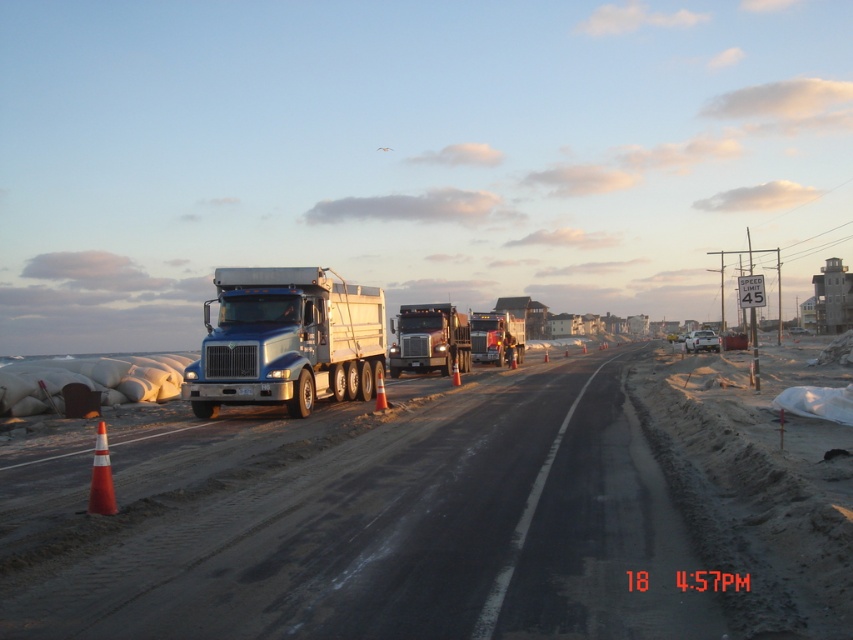
Question: Which of the following is the closest to the observer?

Choices:
 (A) blue metallic trailer truck at center
 (B) metallic silver truck at center

Answer: (A)

Question: In this image, where is blue metallic trailer truck at center located relative to metallic silver trailer truck at center?

Choices:
 (A) below
 (B) above

Answer: (A)

Question: Estimate the real-world distances between objects in this image. Which object is closer to the metallic silver trailer truck at center?

Choices:
 (A) metallic blue truck at center
 (B) blue metallic trailer truck at center
 (C) metallic silver truck at center

Answer: (C)

Question: Can you confirm if blue metallic trailer truck at center is positioned to the left of metallic silver trailer truck at center?

Choices:
 (A) no
 (B) yes

Answer: (B)

Question: Which point is closer to the camera?

Choices:
 (A) (317, 369)
 (B) (412, 337)
 (C) (486, 340)
 (D) (635, 538)

Answer: (D)

Question: Does metallic blue truck at center have a greater width compared to metallic silver truck at center?

Choices:
 (A) yes
 (B) no

Answer: (A)